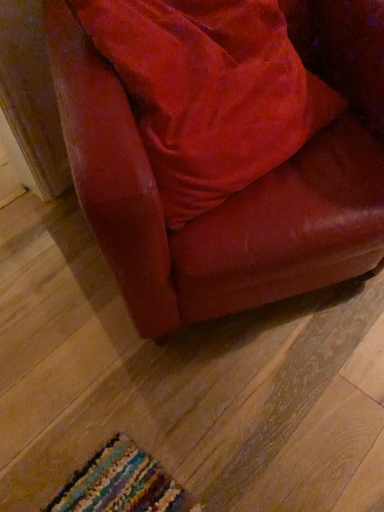
In order to click on velvet red armchair at center in this screenshot , I will do pos(239,192).

What is the approximate height of velvet red armchair at center?

velvet red armchair at center is 34.64 inches tall.

The height and width of the screenshot is (512, 384). What do you see at coordinates (239, 192) in the screenshot? I see `velvet red armchair at center` at bounding box center [239, 192].

This screenshot has width=384, height=512. Find the location of `velvet red armchair at center`. velvet red armchair at center is located at coordinates point(239,192).